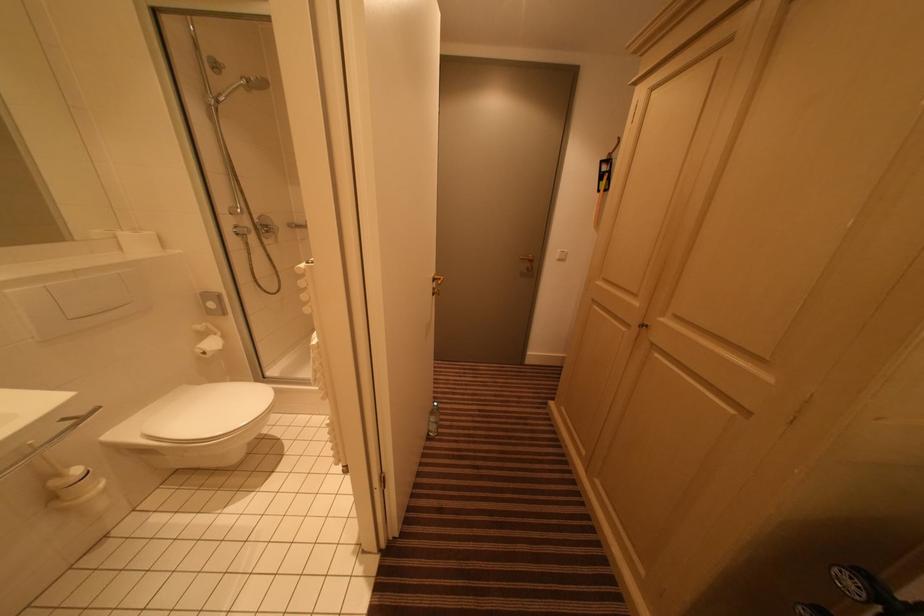
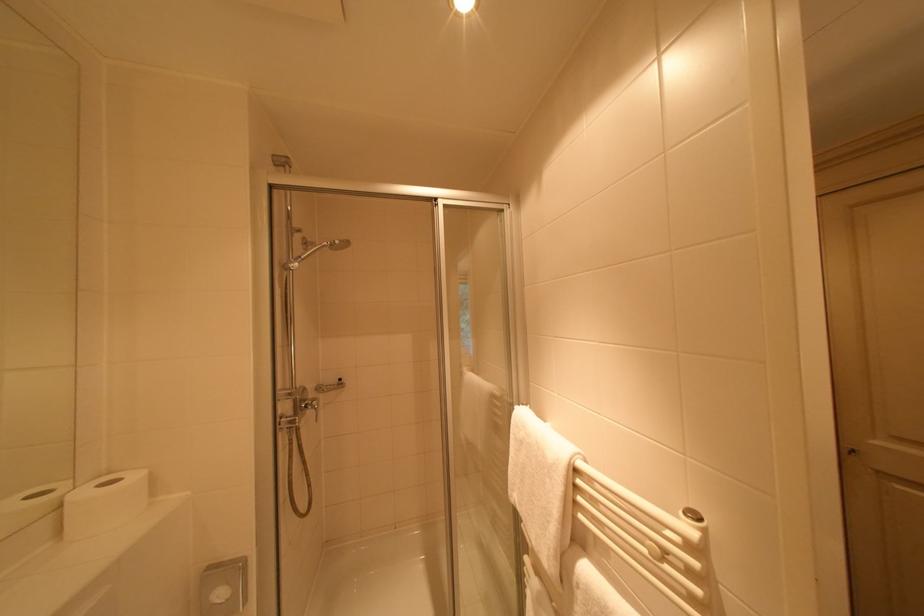
How did the camera likely rotate?

The rotation direction of the camera is right-up.